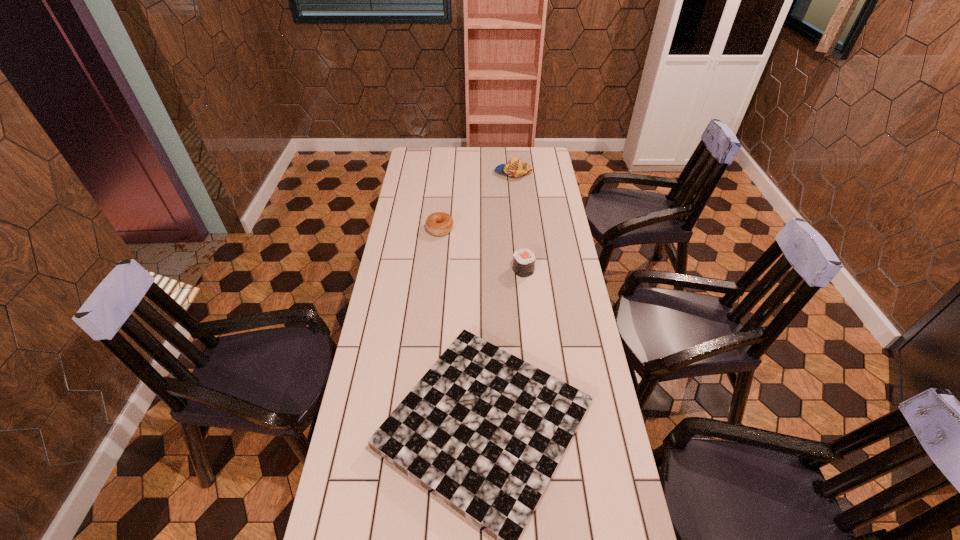
Where is `object located at the left edge`? Image resolution: width=960 pixels, height=540 pixels. object located at the left edge is located at coordinates (439, 223).

I want to click on sushi that is at the right edge, so click(523, 260).

The width and height of the screenshot is (960, 540). Identify the location of cap present at the right edge. (515, 167).

You are a GUI agent. You are given a task and a screenshot of the screen. Output one action in this format:
    pyautogui.click(x=<x>, y=<y>)
    Task: Click on the object located in the far right corner section of the desktop
    
    Given the screenshot: What is the action you would take?
    coord(515,167)

Where is `vacant region at the far edge`? vacant region at the far edge is located at coordinates (446, 170).

This screenshot has width=960, height=540. In order to click on vacant space at the left edge in this screenshot , I will do `click(434, 184)`.

At what (x,y) coordinates should I click in order to perform the action: click on vacant space at the right edge of the desktop. Please return your answer as a coordinate pair (x, y). The height and width of the screenshot is (540, 960). Looking at the image, I should click on (576, 373).

Where is `blank space at the far left corner of the desktop`? blank space at the far left corner of the desktop is located at coordinates (437, 160).

Locate an element on the screen. Image resolution: width=960 pixels, height=540 pixels. unoccupied area between the cap and the second nearest object is located at coordinates (518, 221).

Find the location of a particular element. vacant region between the sushi and the third tallest object is located at coordinates (482, 249).